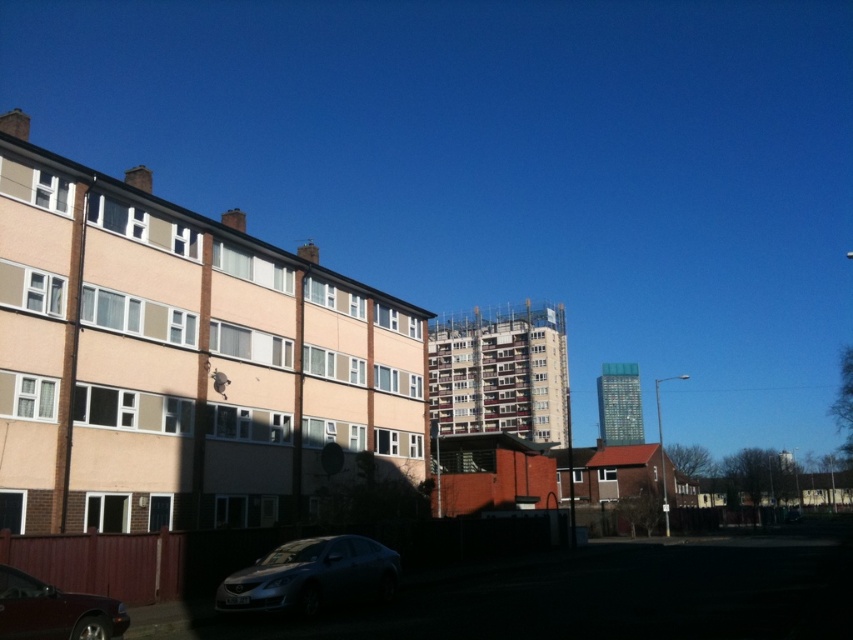
You are standing at the center of the image and want to take a photo of the satin silver sedan at lower center. According to the coordinates provided, in which direction should you move to position yourself directly in front of the sedan?

The satin silver sedan at lower center is located at coordinates point (311, 577). Since the coordinates are given as x,y values between 0 and 1, with (0, 0) being the bottom left corner, moving towards the right and upward would position you directly in front of the sedan.

You are a delivery driver who needs to park your vehicle in this area. You see a satin silver sedan at lower center and a shiny dark red car at lower left. Which vehicle is parked closer to the ground level?

The satin silver sedan at lower center is located below the shiny dark red car at lower left, so it is closer to the ground level.